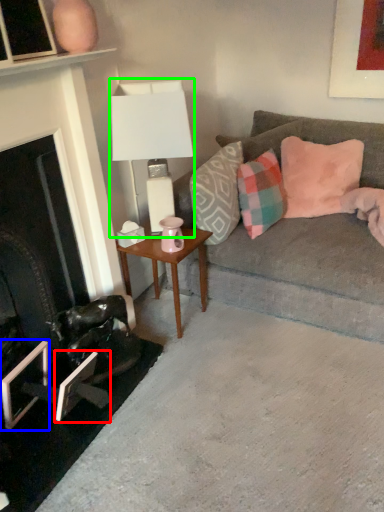
Question: Estimate the real-world distances between objects in this image. Which object is farther from picture frame (highlighted by a red box), picture frame (highlighted by a blue box) or table lamp (highlighted by a green box)?

Choices:
 (A) picture frame
 (B) table lamp

Answer: (B)